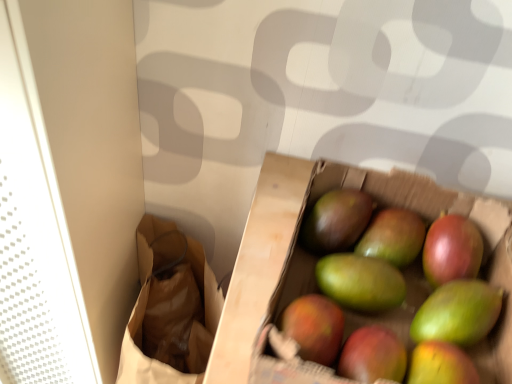
Question: From the image's perspective, is brown paper bag at left beneath green matte mango at center?

Choices:
 (A) yes
 (B) no

Answer: (A)

Question: Would you say brown paper bag at left is a long distance from green matte mango at center?

Choices:
 (A) yes
 (B) no

Answer: (B)

Question: Does brown paper bag at left have a larger size compared to green matte mango at center?

Choices:
 (A) no
 (B) yes

Answer: (B)

Question: From the image's perspective, is brown paper bag at left over green matte mango at center?

Choices:
 (A) yes
 (B) no

Answer: (B)

Question: Can green matte mango at center be found inside brown paper bag at left?

Choices:
 (A) no
 (B) yes

Answer: (A)

Question: Considering the positions of green matte mango at center and shiny red grapefruit at center right, acting as the second grapefruit starting from the left, in the image, is green matte mango at center taller or shorter than shiny red grapefruit at center right, acting as the second grapefruit starting from the left,?

Choices:
 (A) tall
 (B) short

Answer: (B)

Question: Which is correct: green matte mango at center is inside shiny red grapefruit at center right, which is counted as the first grapefruit, starting from the right, or outside of it?

Choices:
 (A) inside
 (B) outside

Answer: (B)

Question: In terms of width, does green matte mango at center look wider or thinner when compared to shiny red grapefruit at center right, acting as the second grapefruit starting from the left?

Choices:
 (A) wide
 (B) thin

Answer: (B)

Question: Relative to shiny red grapefruit at center right, acting as the second grapefruit starting from the left, is green matte mango at center in front or behind?

Choices:
 (A) behind
 (B) front

Answer: (A)

Question: Relative to green matte mango at center, the 1th grapefruit viewed from the left, is green matte mango at center in front or behind?

Choices:
 (A) behind
 (B) front

Answer: (A)

Question: Based on their sizes in the image, would you say green matte mango at center is bigger or smaller than green matte mango at center, the second grapefruit when ordered from right to left?

Choices:
 (A) small
 (B) big

Answer: (A)

Question: Is point (372, 236) positioned closer to the camera than point (368, 243)?

Choices:
 (A) closer
 (B) farther

Answer: (B)

Question: From the image's perspective, is green matte mango at center positioned above or below green matte mango at center, the 1th grapefruit viewed from the left?

Choices:
 (A) above
 (B) below

Answer: (A)

Question: In the image, is green matte mango at center positioned in front of or behind green matte mango at center, the 1th grapefruit viewed from the left?

Choices:
 (A) behind
 (B) front

Answer: (A)

Question: Is point (315, 235) closer or farther from the camera than point (359, 210)?

Choices:
 (A) closer
 (B) farther

Answer: (B)